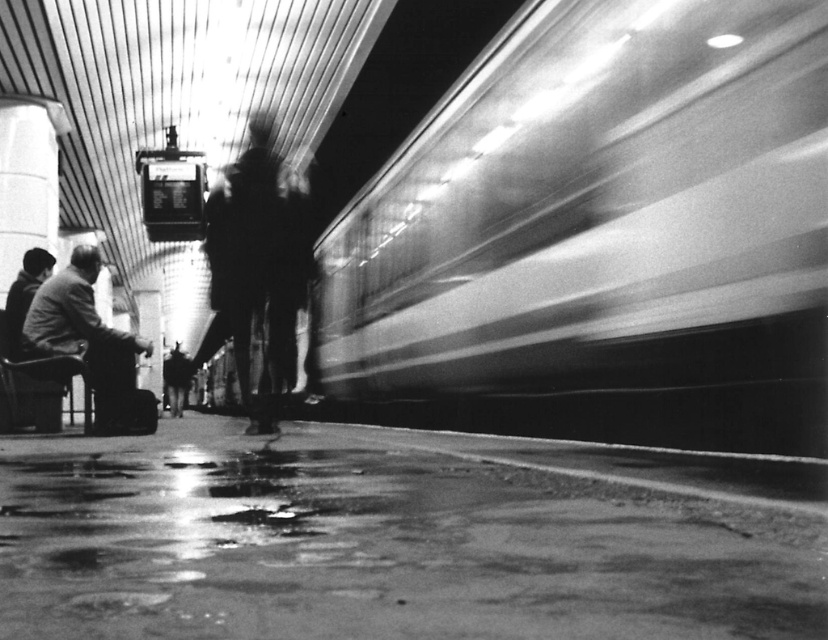
Question: Can you confirm if smooth metallic train at right is positioned below dark gray wool coat at lower left?

Choices:
 (A) no
 (B) yes

Answer: (B)

Question: Is the position of smooth metallic train at right less distant than that of dark gray wool coat at lower left?

Choices:
 (A) yes
 (B) no

Answer: (A)

Question: Observing the image, what is the correct spatial positioning of smooth metallic train at right in reference to dark gray wool coat at lower left?

Choices:
 (A) above
 (B) below

Answer: (B)

Question: Which point is farther to the camera?

Choices:
 (A) smooth metallic train at right
 (B) dark gray wool coat at lower left

Answer: (B)